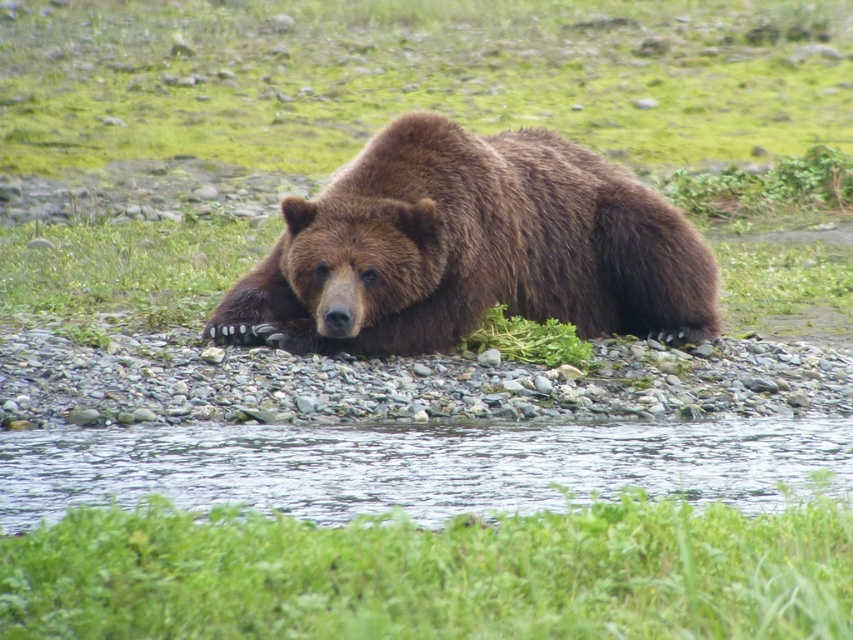
You are a photographer trying to capture the brown furry bear at center. You notice the green leafy grass at lower center might block your view. Can you estimate if the grass is thick enough to obscure the bear?

The green leafy grass at lower center is thinner than the brown furry bear at center, so it is unlikely to completely block the view of the bear.

You are a wildlife photographer aiming to capture the brown furry bear at center and the clear water at center in a single frame. Based on their sizes, which object should you focus on first to ensure both are in the frame?

The brown furry bear at center is bigger than clear water at center, so you should focus on the brown furry bear at center first to ensure both are in the frame.

You are a wildlife photographer standing on the riverbank. You want to take a photo of the brown furry bear at center and the clear water at center in the same frame. Given that your camera has a maximum focus range of 10 feet, will you be able to capture both subjects clearly?

The distance between the brown furry bear at center and the clear water at center is 8.87 feet, which is within the camera maximum focus range of 10 feet. Therefore, you can capture both subjects clearly.